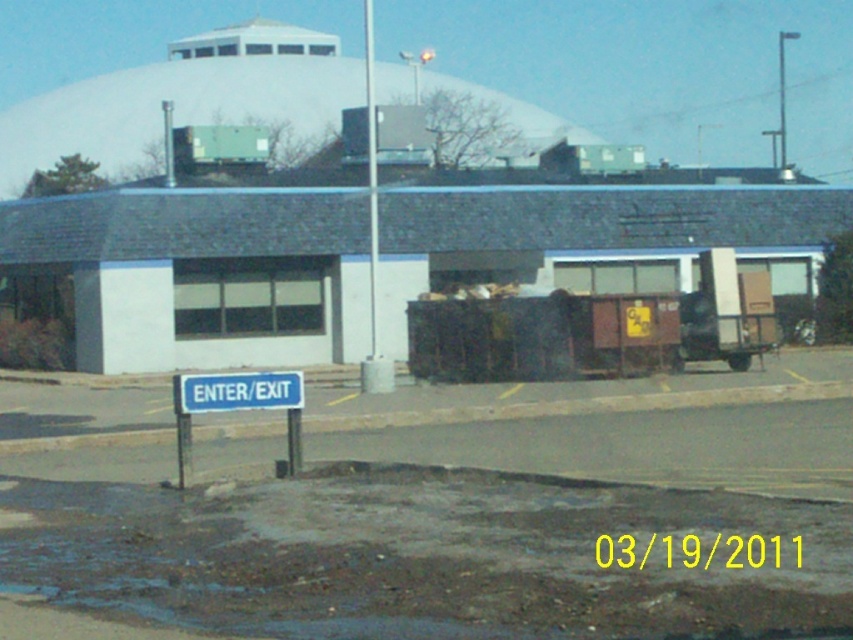
You are a delivery driver who needs to back up your truck to the entrance of the building. The truck requires a minimum of 30 meters of clearance to safely maneuver. Based on the image, can you safely back up your truck using the space between the blue plastic sign at lower left and the metallic pole at upper center?

The distance between the blue plastic sign at lower left and the metallic pole at upper center is 33.93 meters, which exceeds the required 30 meters of clearance. Therefore, you can safely back up your truck using the space between them.